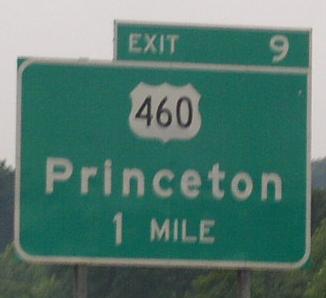
This screenshot has height=298, width=326. I want to click on exit sign, so point(185,45).